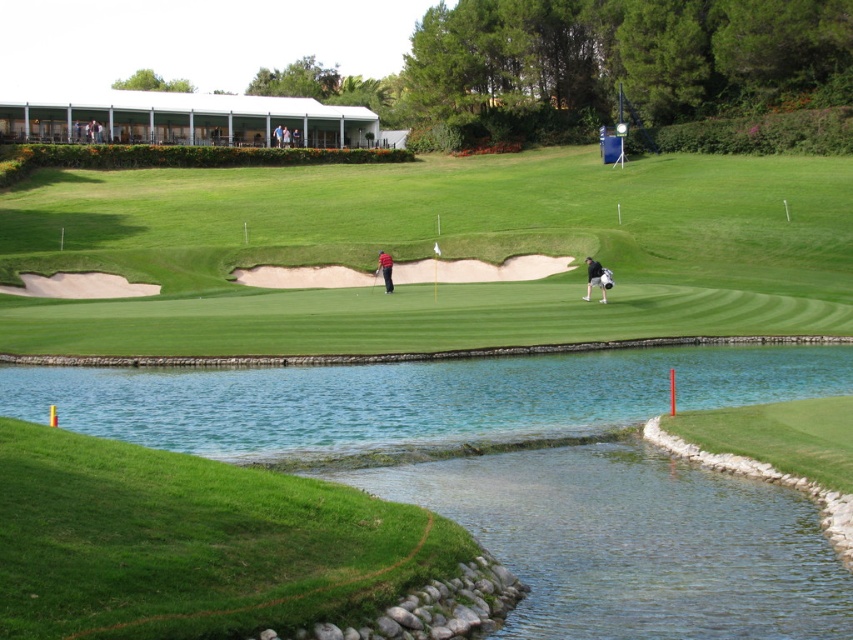
Question: Is green grassy golf course at center closer to the viewer compared to black fabric golf bag at center?

Choices:
 (A) yes
 (B) no

Answer: (A)

Question: Can you confirm if black fabric golf bag at center is positioned to the right of red matte golf club at center?

Choices:
 (A) no
 (B) yes

Answer: (B)

Question: From the image, what is the correct spatial relationship of green grassy golf course at center in relation to red matte golf club at center?

Choices:
 (A) right
 (B) left

Answer: (A)

Question: Which point is closer to the camera?

Choices:
 (A) (386, 275)
 (B) (67, 189)
 (C) (585, 294)

Answer: (C)

Question: Estimate the real-world distances between objects in this image. Which object is closer to the red matte golf club at center?

Choices:
 (A) black fabric golf bag at center
 (B) green grassy golf course at center

Answer: (A)

Question: Which point is closer to the camera?

Choices:
 (A) (374, 276)
 (B) (312, 344)
 (C) (585, 296)
 (D) (386, 285)

Answer: (B)